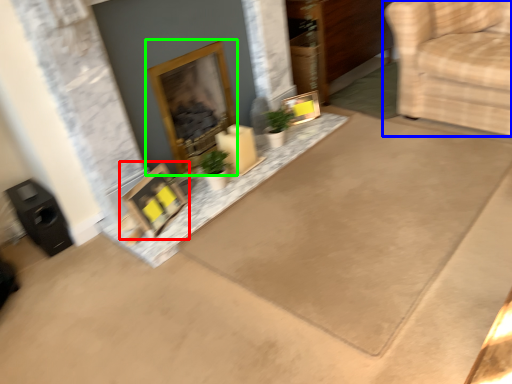
Question: Which object is the closest to the picture frame (highlighted by a red box)? Choose among these: furniture (highlighted by a blue box) or fireplace (highlighted by a green box).

Choices:
 (A) furniture
 (B) fireplace

Answer: (B)